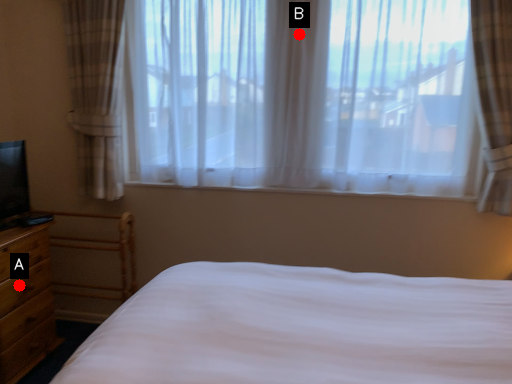
Question: Two points are circled on the image, labeled by A and B beside each circle. Which point is closer to the camera?

Choices:
 (A) A is closer
 (B) B is closer

Answer: (A)